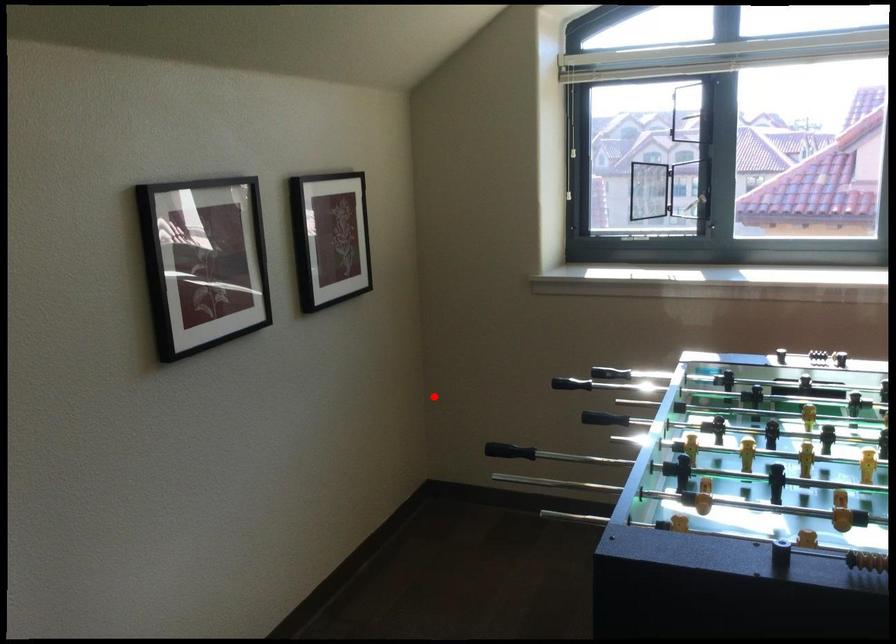
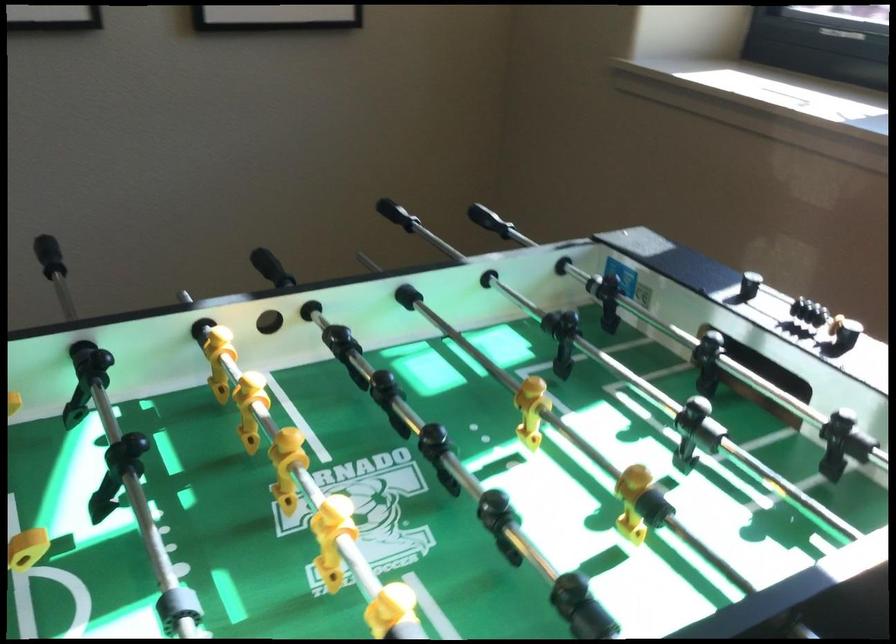
Question: I am providing you with two images of the same scene from different viewpoints. A red point is marked on the first image. Is the red point's position out of view in image 2?

Choices:
 (A) Yes
 (B) No

Answer: (B)